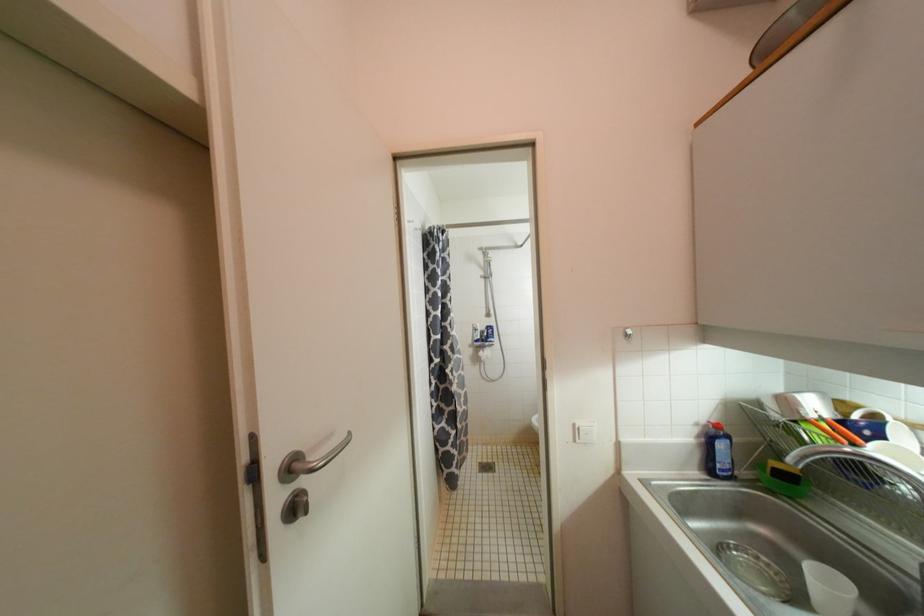
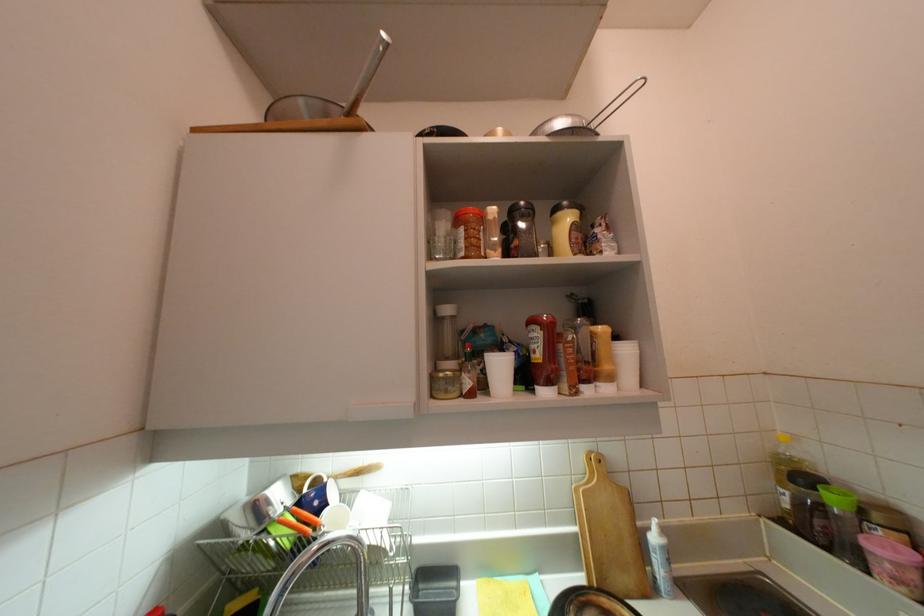
Where in the second image is the point corresponding to the point at 864,408 from the first image?

(311, 477)